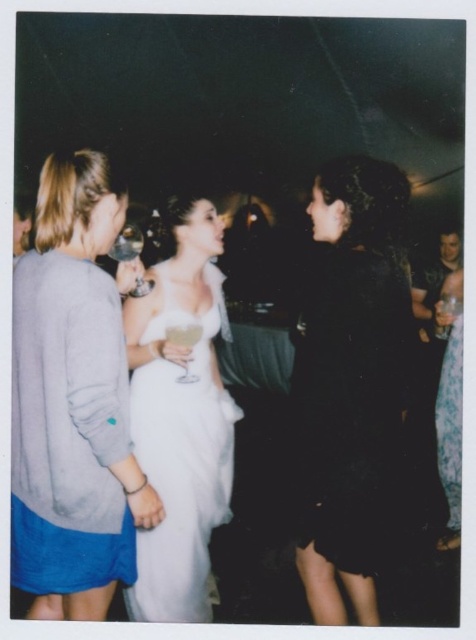
Question: Is white satin dress at center thinner than translucent glass wine at center?

Choices:
 (A) yes
 (B) no

Answer: (B)

Question: Is clear glass wine glass at center further to the viewer compared to translucent glass wine at center?

Choices:
 (A) no
 (B) yes

Answer: (A)

Question: Which object appears farthest from the camera in this image?

Choices:
 (A) black velvet dress at center
 (B) translucent glass wine at center

Answer: (B)

Question: Estimate the real-world distances between objects in this image. Which object is closer to the clear glass wine glass at center?

Choices:
 (A) floral-patterned fabric dress at right
 (B) white satin dress at center

Answer: (B)

Question: Which of the following is the closest to the observer?

Choices:
 (A) (138, 243)
 (B) (28, 381)
 (C) (162, 336)

Answer: (B)

Question: Is floral-patterned fabric dress at right to the left of clear glass wine glass at center from the viewer's perspective?

Choices:
 (A) yes
 (B) no

Answer: (B)